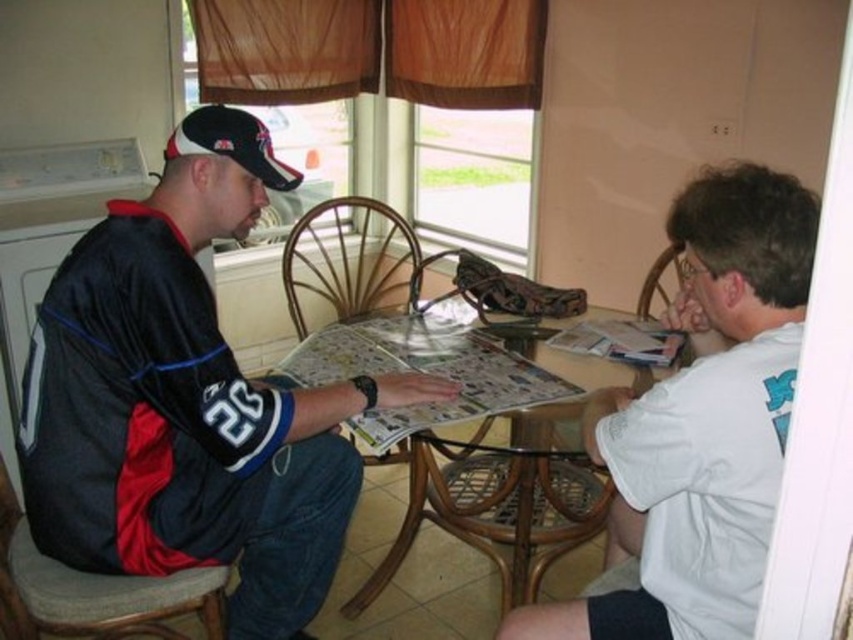
Does clear glass table at center have a smaller size compared to wicker chair at right?

Actually, clear glass table at center might be larger than wicker chair at right.

Which is more to the right, clear glass table at center or wicker chair at right?

From the viewer's perspective, wicker chair at right appears more on the right side.

Where is `clear glass table at center`? This screenshot has width=853, height=640. clear glass table at center is located at coordinates (467, 448).

What are the coordinates of `clear glass table at center` in the screenshot? It's located at (467, 448).

Between white matte shirt at upper right and brown woven chair at lower left, which one appears on the left side from the viewer's perspective?

brown woven chair at lower left is more to the left.

Can you confirm if white matte shirt at upper right is bigger than brown woven chair at lower left?

Yes, white matte shirt at upper right is bigger than brown woven chair at lower left.

Who is more forward, (764, 212) or (4, 538)?

Point (764, 212)

This screenshot has width=853, height=640. Find the location of `white matte shirt at upper right`. white matte shirt at upper right is located at coordinates click(x=701, y=422).

Is point (288, 240) less distant than point (254, 132)?

No, it is not.

Which is behind, point (410, 237) or point (213, 125)?

The point (410, 237) is more distant.

Between point (389, 307) and point (209, 106), which one is positioned behind?

Point (389, 307)

Where is `bamboo chair at center`? The height and width of the screenshot is (640, 853). bamboo chair at center is located at coordinates (351, 260).